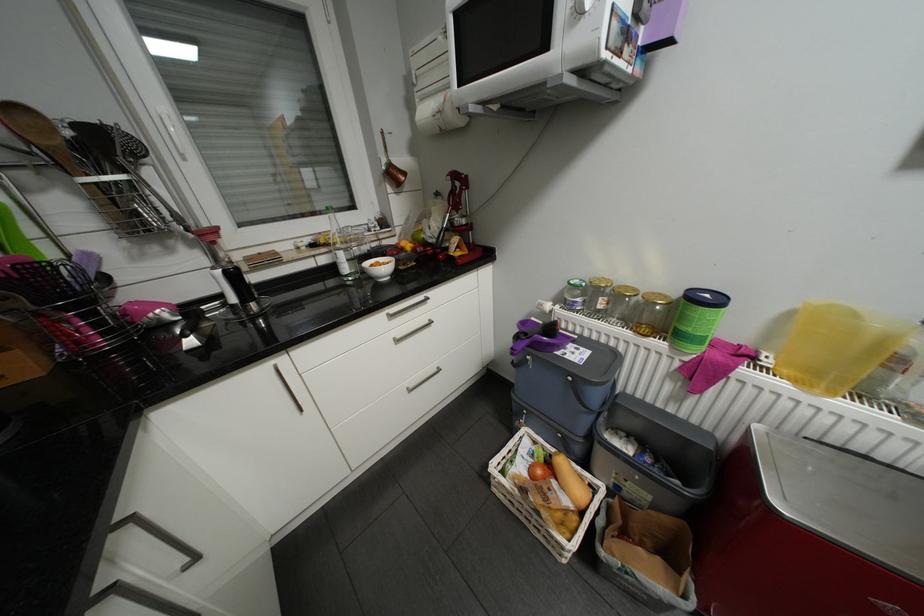
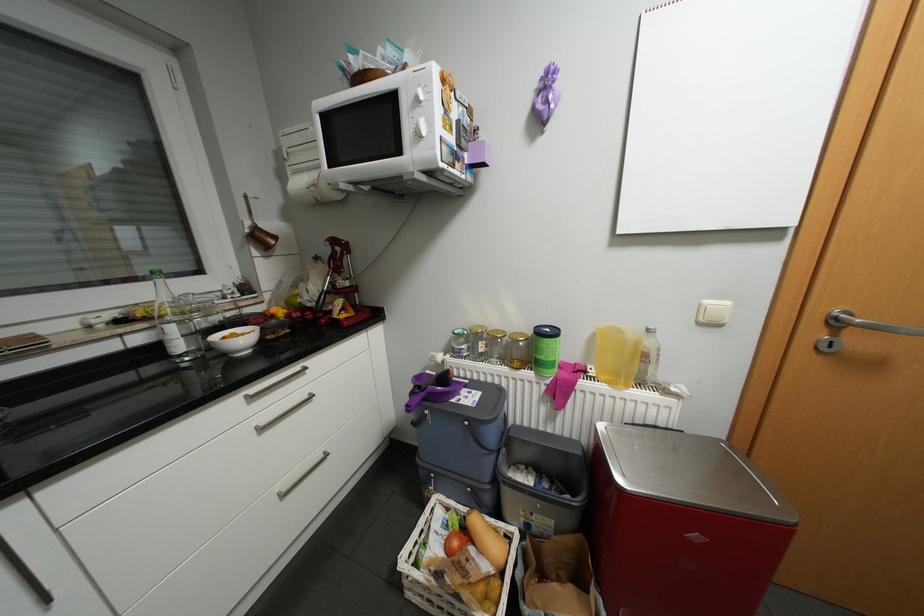
In the second image, find the point that corresponds to pixel 391 267 in the first image.

(249, 339)